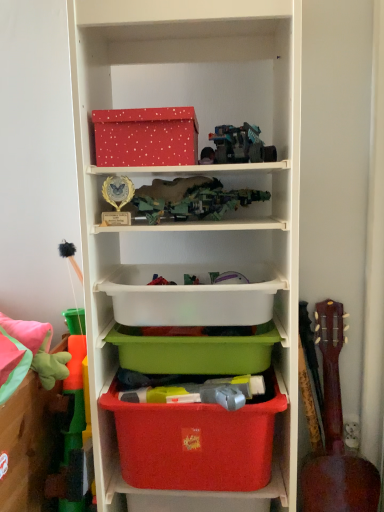
Question: Is brown wooden guitar at right taller or shorter than matte plastic storage box at lower center, the 1th storage box positioned from the bottom?

Choices:
 (A) short
 (B) tall

Answer: (B)

Question: Which is correct: brown wooden guitar at right is inside matte plastic storage box at lower center, the 1th storage box positioned from the bottom, or outside of it?

Choices:
 (A) outside
 (B) inside

Answer: (A)

Question: Considering the real-world distances, which object is farthest from the brown wooden guitar at right?

Choices:
 (A) matte plastic storage box at lower center, which is counted as the fourth storage box, starting from the top
 (B) green plastic toy at left, placed as the first toy when sorted from left to right
 (C) teal plastic toy truck at upper center, arranged as the second toy when ordered from the bottom
 (D) matte plastic shelf at center
 (E) red dotted cardboard box at upper center

Answer: (E)

Question: Which is nearer to the matte plastic shelf at center?

Choices:
 (A) brown wooden guitar at right
 (B) green plastic container at center, which is the 3th storage box from bottom to top
 (C) matte plastic storage box at lower center, which is counted as the fourth storage box, starting from the top
 (D) white plastic container at center, which is the 1th storage box in top-to-bottom order
 (E) green plastic toy at left, which is the second toy in right-to-left order

Answer: (D)